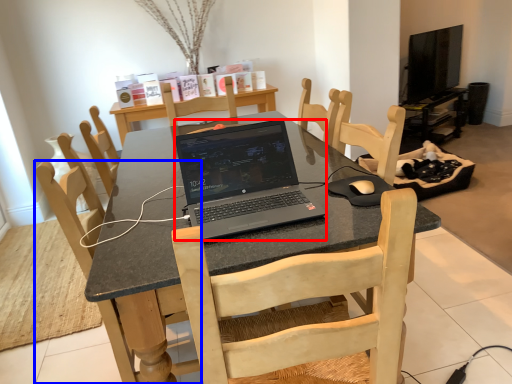
Question: Which of the following is the closest to the observer, laptop (highlighted by a red box) or chair (highlighted by a blue box)?

Choices:
 (A) laptop
 (B) chair

Answer: (A)